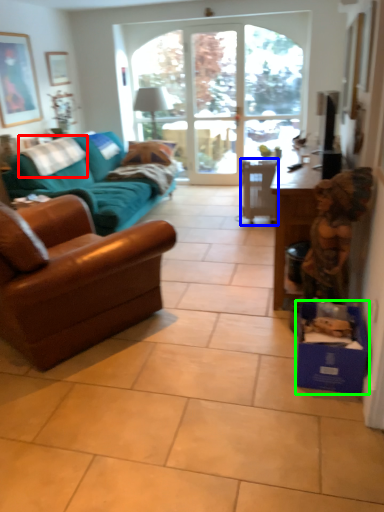
Question: Which is farther away from pillow (highlighted by a red box)? chair (highlighted by a blue box) or cardboard box (highlighted by a green box)?

Choices:
 (A) chair
 (B) cardboard box

Answer: (B)